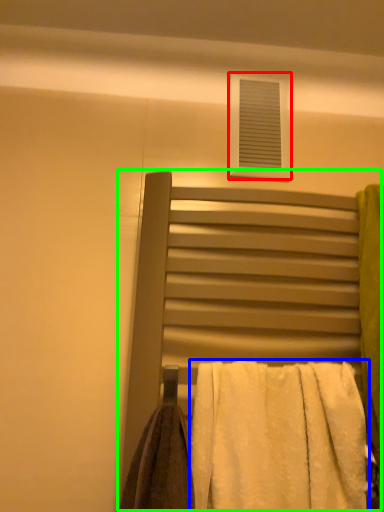
Question: Based on their relative distances, which object is nearer to window (highlighted by a red box)? Choose from towel (highlighted by a blue box) and bed (highlighted by a green box).

Choices:
 (A) towel
 (B) bed

Answer: (B)